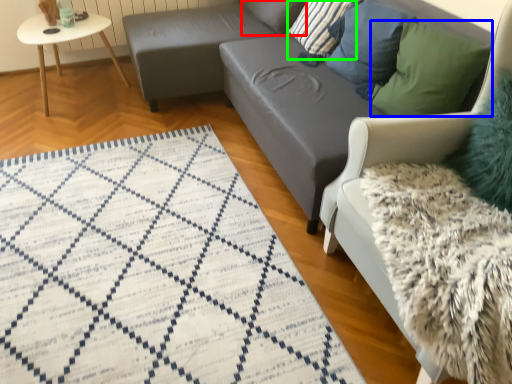
Question: Which is nearer to the pillow (highlighted by a red box)? pillow (highlighted by a blue box) or pillow (highlighted by a green box).

Choices:
 (A) pillow
 (B) pillow

Answer: (B)